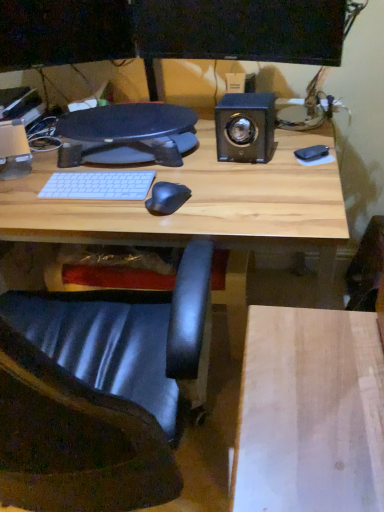
Question: Is metallic black speaker at upper right bigger than black leather chair at lower left?

Choices:
 (A) no
 (B) yes

Answer: (A)

Question: From the image's perspective, is metallic black speaker at upper right beneath black leather chair at lower left?

Choices:
 (A) no
 (B) yes

Answer: (A)

Question: From a real-world perspective, is metallic black speaker at upper right positioned under black leather chair at lower left based on gravity?

Choices:
 (A) no
 (B) yes

Answer: (A)

Question: Is metallic black speaker at upper right at the right side of black leather chair at lower left?

Choices:
 (A) yes
 (B) no

Answer: (A)

Question: Is black leather chair at lower left inside metallic black speaker at upper right?

Choices:
 (A) no
 (B) yes

Answer: (A)

Question: Is metallic black speaker at upper right aimed at black leather chair at lower left?

Choices:
 (A) yes
 (B) no

Answer: (A)

Question: Can you confirm if black leather chair at lower left is shorter than metallic black speaker at upper right?

Choices:
 (A) no
 (B) yes

Answer: (A)

Question: Is black leather chair at lower left behind metallic black speaker at upper right?

Choices:
 (A) no
 (B) yes

Answer: (A)

Question: Is black leather chair at lower left facing towards metallic black speaker at upper right?

Choices:
 (A) yes
 (B) no

Answer: (A)

Question: Can you confirm if black leather chair at lower left is taller than metallic black speaker at upper right?

Choices:
 (A) yes
 (B) no

Answer: (A)

Question: Can you see black leather chair at lower left touching metallic black speaker at upper right?

Choices:
 (A) yes
 (B) no

Answer: (B)

Question: From the image's perspective, would you say black leather chair at lower left is shown under metallic black speaker at upper right?

Choices:
 (A) yes
 (B) no

Answer: (A)

Question: From a real-world perspective, relative to black leather chair at lower left, is metallic black speaker at upper right vertically above or below?

Choices:
 (A) below
 (B) above

Answer: (B)